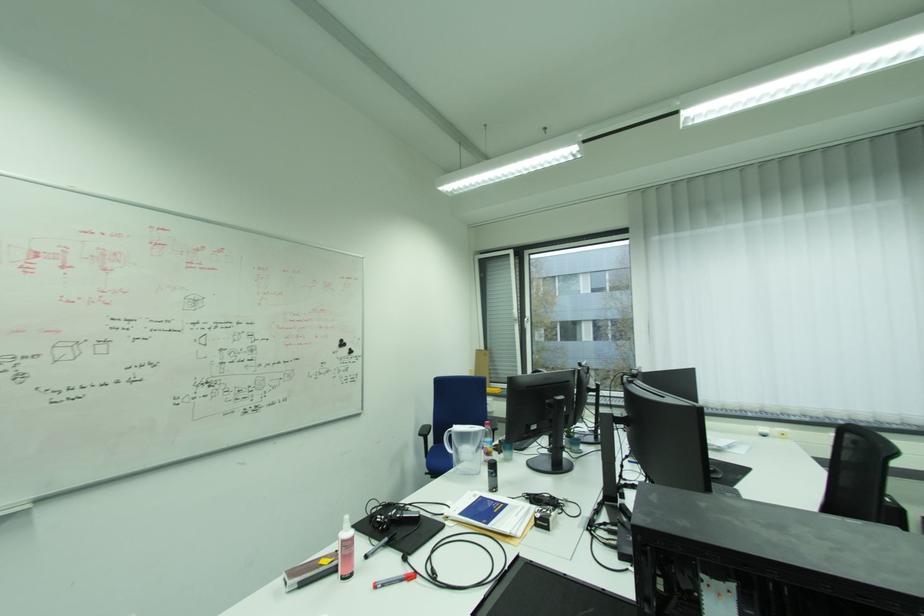
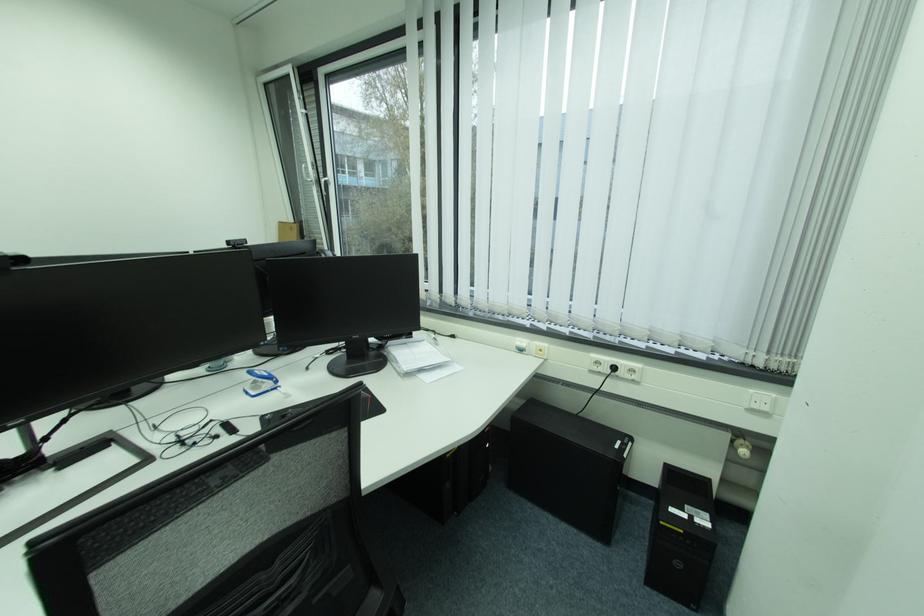
Which direction would the cameraman need to move to produce the second image?

The cameraman moved toward right, forward.